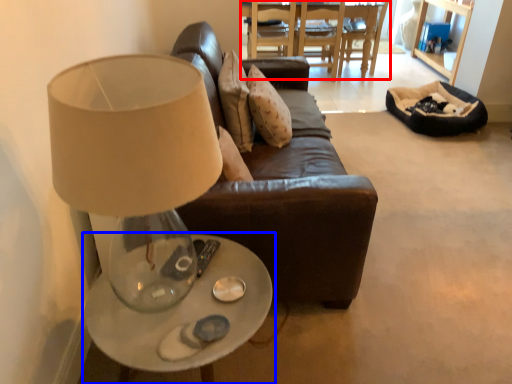
Question: Which object appears farthest to the camera in this image, table (highlighted by a red box) or table (highlighted by a blue box)?

Choices:
 (A) table
 (B) table

Answer: (A)